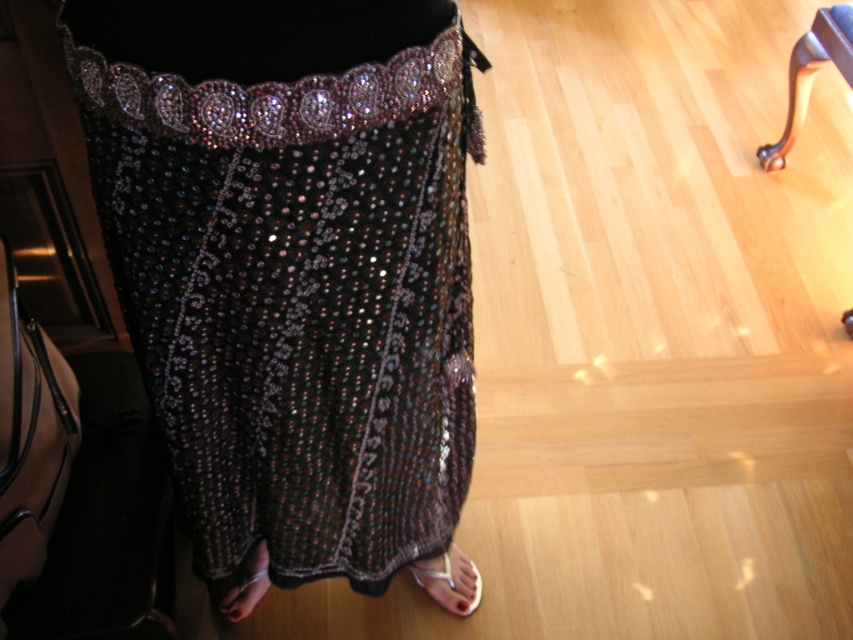
Which is above, shiny sequined dress at center or polished wood leg at upper right?

polished wood leg at upper right is higher up.

Who is shorter, shiny sequined dress at center or polished wood leg at upper right?

With less height is polished wood leg at upper right.

Does point (254, 336) come in front of point (839, 28)?

Yes, point (254, 336) is closer to viewer.

This screenshot has height=640, width=853. Identify the location of shiny sequined dress at center. (292, 266).

Is shiny sequined dress at center wider than shiny metallic sandal at lower center?

Correct, the width of shiny sequined dress at center exceeds that of shiny metallic sandal at lower center.

Does shiny sequined dress at center have a larger size compared to shiny metallic sandal at lower center?

Yes.

At what (x,y) coordinates should I click in order to perform the action: click on shiny sequined dress at center. Please return your answer as a coordinate pair (x, y). The height and width of the screenshot is (640, 853). Looking at the image, I should click on (292, 266).

Find the location of a particular element. The image size is (853, 640). shiny sequined dress at center is located at coordinates (292, 266).

Is shiny sequined dress at center wider than metallic silver sandal at lower center?

Yes.

Between shiny sequined dress at center and metallic silver sandal at lower center, which one is positioned higher?

shiny sequined dress at center is higher up.

Between point (252, 372) and point (450, 563), which one is positioned in front?

Positioned in front is point (252, 372).

This screenshot has width=853, height=640. In order to click on shiny sequined dress at center in this screenshot , I will do `click(292, 266)`.